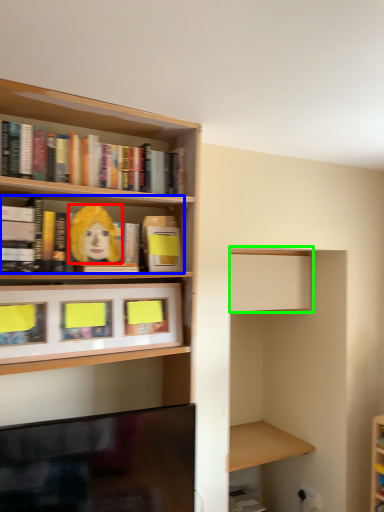
Question: Which is nearer to the person (highlighted by a red box)? book (highlighted by a blue box) or cabinet (highlighted by a green box).

Choices:
 (A) book
 (B) cabinet

Answer: (A)